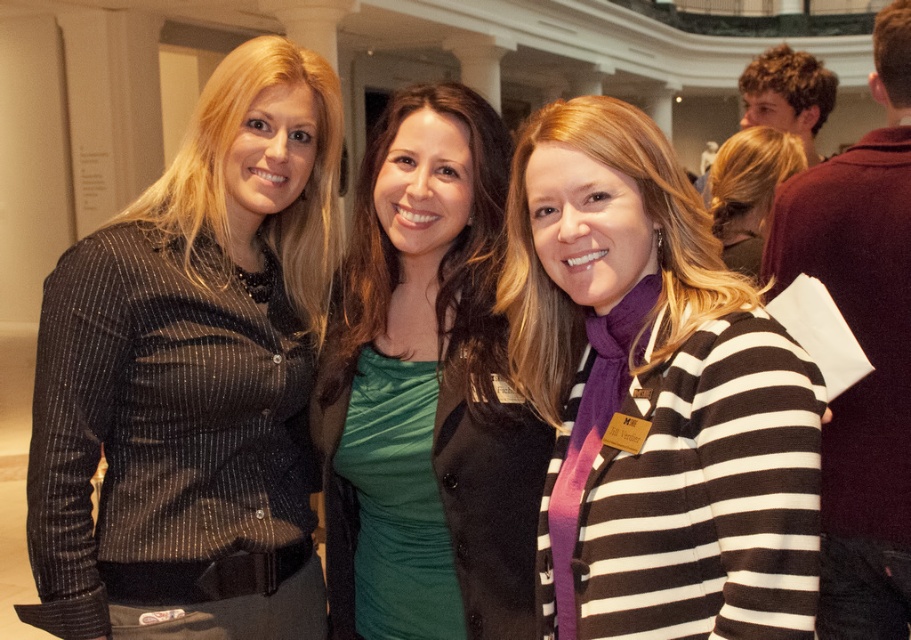
Can you confirm if striped sweater at center is thinner than matte black shirt at center?

Correct, striped sweater at center's width is less than matte black shirt at center's.

Can you confirm if striped sweater at center is bigger than matte black shirt at center?

Incorrect, striped sweater at center is not larger than matte black shirt at center.

Image resolution: width=911 pixels, height=640 pixels. Identify the location of striped sweater at center. (653, 396).

Does point (109, 280) lie behind point (657, 600)?

Yes.

The height and width of the screenshot is (640, 911). In order to click on matte black blouse at left in this screenshot , I will do `click(193, 376)`.

Can you confirm if matte black blouse at left is positioned to the right of matte black shirt at center?

Incorrect, matte black blouse at left is not on the right side of matte black shirt at center.

Between point (121, 611) and point (771, 186), which one is positioned in front?

Point (121, 611) is in front.

Image resolution: width=911 pixels, height=640 pixels. In order to click on matte black blouse at left in this screenshot , I will do 193,376.